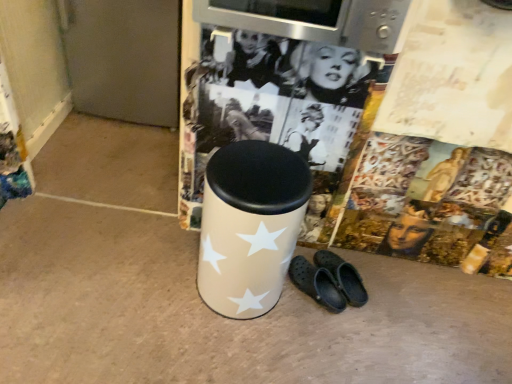
Question: From the image's perspective, is black rubber crocs at lower center on beige fabric waste bin at center?

Choices:
 (A) no
 (B) yes

Answer: (A)

Question: Does black rubber crocs at lower center turn towards beige fabric waste bin at center?

Choices:
 (A) yes
 (B) no

Answer: (A)

Question: Are black rubber crocs at lower center and beige fabric waste bin at center located far from each other?

Choices:
 (A) yes
 (B) no

Answer: (B)

Question: Is black rubber crocs at lower center positioned in front of beige fabric waste bin at center?

Choices:
 (A) yes
 (B) no

Answer: (B)

Question: Can we say black rubber crocs at lower center lies outside beige fabric waste bin at center?

Choices:
 (A) no
 (B) yes

Answer: (B)

Question: From a real-world perspective, is black rubber crocs at lower center under beige fabric waste bin at center?

Choices:
 (A) yes
 (B) no

Answer: (A)

Question: Does beige fabric waste bin at center lie behind black rubber crocs at lower center?

Choices:
 (A) yes
 (B) no

Answer: (B)

Question: Is beige fabric waste bin at center taller than black rubber crocs at lower center?

Choices:
 (A) no
 (B) yes

Answer: (B)

Question: Considering the relative sizes of beige fabric waste bin at center and black rubber crocs at lower center in the image provided, is beige fabric waste bin at center wider than black rubber crocs at lower center?

Choices:
 (A) yes
 (B) no

Answer: (A)

Question: Considering the relative positions of beige fabric waste bin at center and black rubber crocs at lower center in the image provided, is beige fabric waste bin at center to the right of black rubber crocs at lower center from the viewer's perspective?

Choices:
 (A) no
 (B) yes

Answer: (A)

Question: Does beige fabric waste bin at center have a lesser width compared to black rubber crocs at lower center?

Choices:
 (A) yes
 (B) no

Answer: (B)

Question: Can we say beige fabric waste bin at center lies outside black rubber crocs at lower center?

Choices:
 (A) no
 (B) yes

Answer: (B)

Question: From a real-world perspective, is black rubber crocs at lower center above or below beige fabric waste bin at center?

Choices:
 (A) below
 (B) above

Answer: (A)